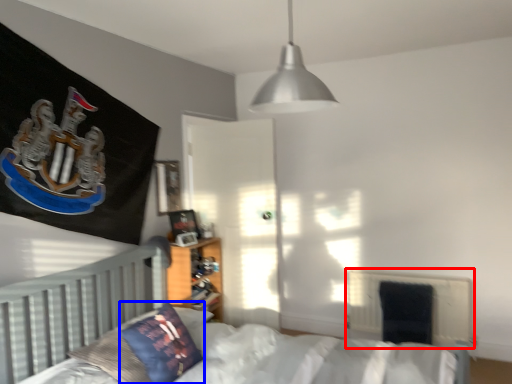
Question: Among these objects, which one is farthest to the camera, radiator (highlighted by a red box) or pillow (highlighted by a blue box)?

Choices:
 (A) radiator
 (B) pillow

Answer: (A)